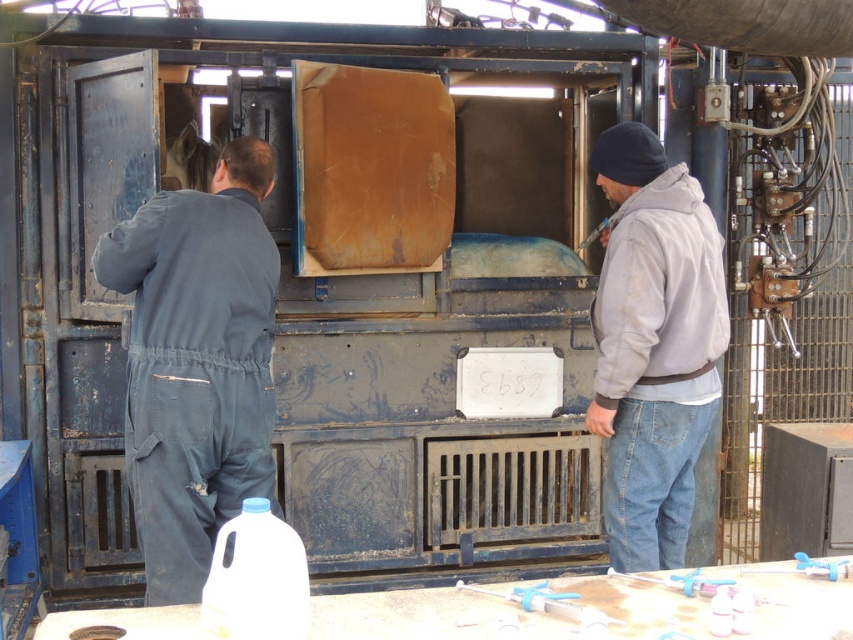
You are a worker at the construction site. You need to place a new label on the machine that is taller than the gray fleece jacket at right. Will the label fit if it is the same height as the white plastic bottle at lower left?

The gray fleece jacket at right is much taller than the white plastic bottle at lower left. Since the label needs to be taller than the jacket, a label the size of the bottle would not be sufficient.

You are a worker at the construction site and need to choose a warmer clothing item between the dark grey coveralls at left and the gray fleece jacket at right. Which one would provide better insulation based on their sizes?

The dark grey coveralls at left has a larger size compared to gray fleece jacket at right, so it would provide better insulation as larger clothing items generally trap more body heat.

You are standing at the origin of the coordinate system in the image. The dark grey coveralls at left is located at point [196,362]. If you want to move towards the dark grey coveralls at left, which direction should you move in terms of x and y coordinates?

To move towards the dark grey coveralls at left located at point [196,362], you should move in the positive x and positive y direction since the coordinates are both greater than the origin.